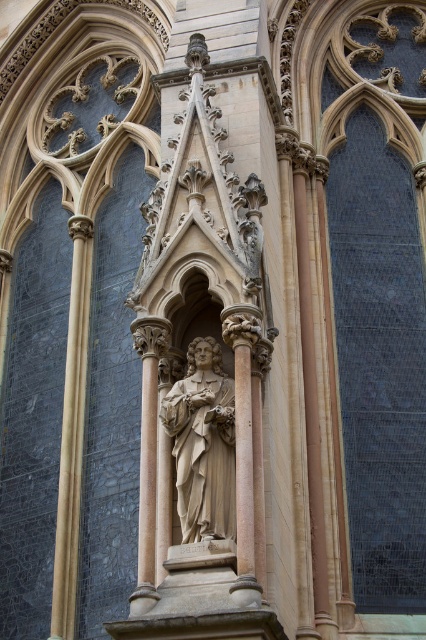
You are an architect examining a Gothic cathedral structure. You notice two points on the statue and its surrounding architecture. The first point is at coordinates point [187,408], and the second is at point [150,552]. From your vantage point, which of these two points is closer to you?

Point [187,408] is further to the camera than point [150,552], so the point closer to you is point [150,552].

You are an architect examining the Gothic structure. You need to determine the spatial relationship between the polished stone statue at center and the beige stone column at center. Which object is positioned to the right of the other?

The polished stone statue at center is positioned to the right of the beige stone column at center.

In the scene shown: You are an architect examining the Gothic structure and need to place a new decorative element. Given the coordinates of the polished stone statue at center, where should you position it relative to the statue to maintain symmetry?

The polished stone statue at center is located at point [203,444], so to maintain symmetry, the new decorative element should be placed at the mirror image coordinates relative to the statue.